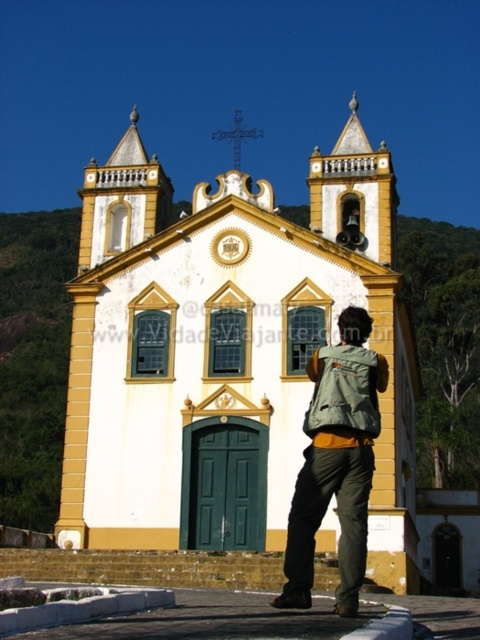
In the scene shown: You are standing in front of the yellow painted stone church at center and the green canvas backpack at lower center. Which object is more to the left?

The yellow painted stone church at center is positioned on the left side of the green canvas backpack at lower center, so it is more to the left.